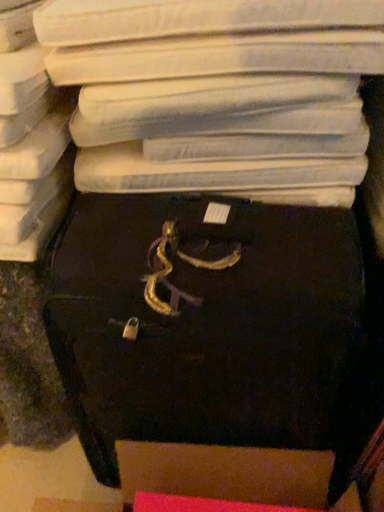
What are the coordinates of `black leather suitcase at center` in the screenshot? It's located at (203, 323).

The height and width of the screenshot is (512, 384). Describe the element at coordinates (203, 323) in the screenshot. I see `black leather suitcase at center` at that location.

The width and height of the screenshot is (384, 512). I want to click on black leather suitcase at center, so click(203, 323).